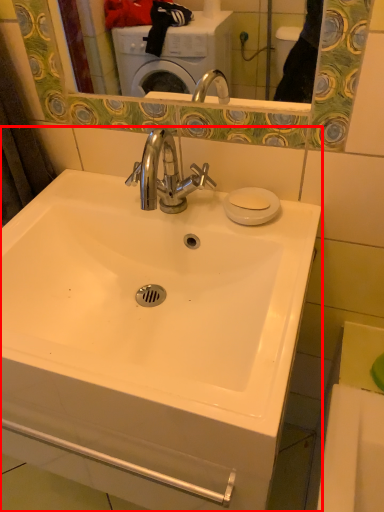
Question: From the image, what is the correct spatial relationship of sink (annotated by the red box) in relation to soap?

Choices:
 (A) left
 (B) right

Answer: (A)